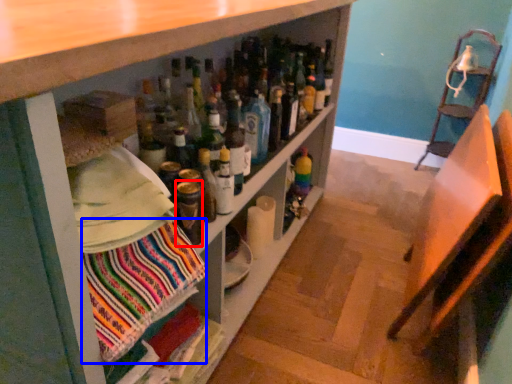
Question: Which of the following is the farthest to the observer, bottle (highlighted by a red box) or fabric (highlighted by a blue box)?

Choices:
 (A) bottle
 (B) fabric

Answer: (A)